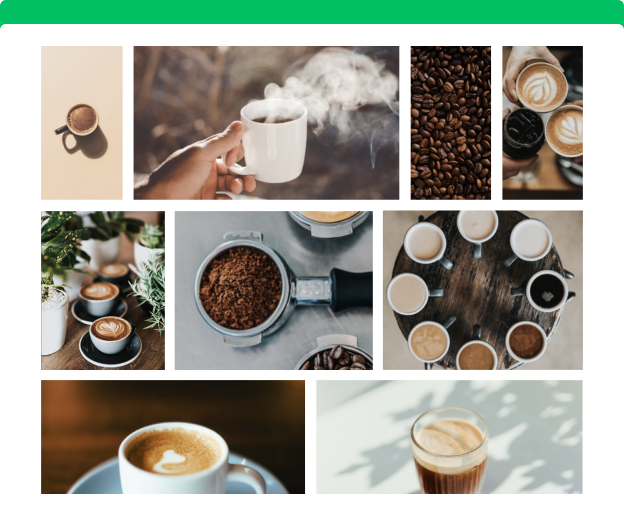
Locate an element on the screen. The width and height of the screenshot is (624, 514). coffee drinks on round wood tray is located at coordinates (432, 343), (412, 293), (425, 244), (478, 218), (530, 240), (547, 291), (529, 336), (478, 361).